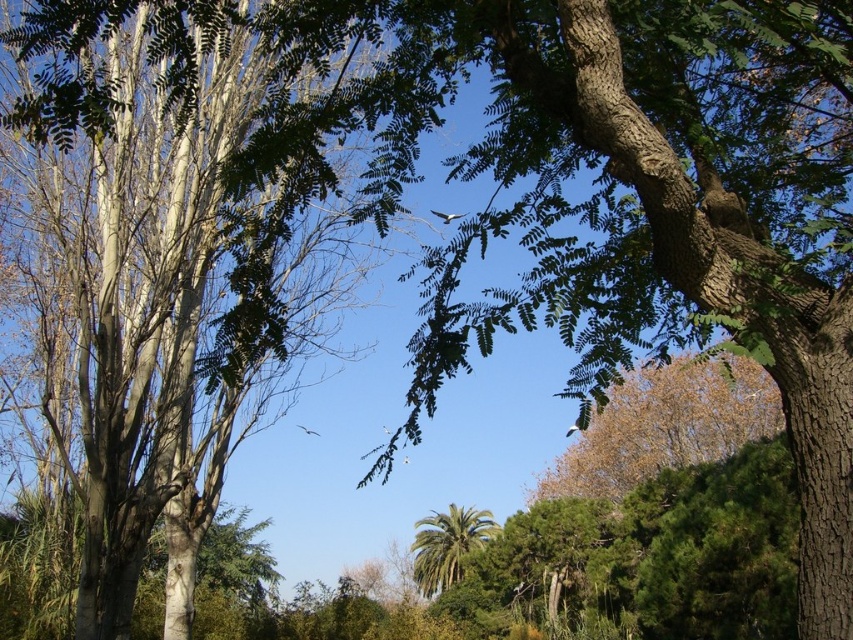
You are planning to plant a new tree in your garden. You have two options from the image shown. Which tree has a narrower width? Please choose between the green leafy tree at center and the green leafy palm at center.

The green leafy tree at center has a narrower width compared to the green leafy palm at center.